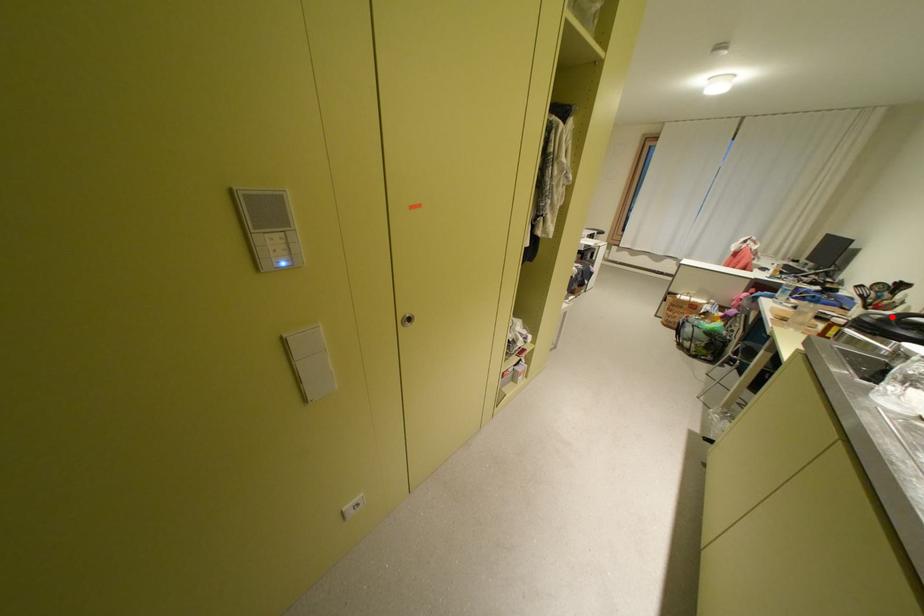
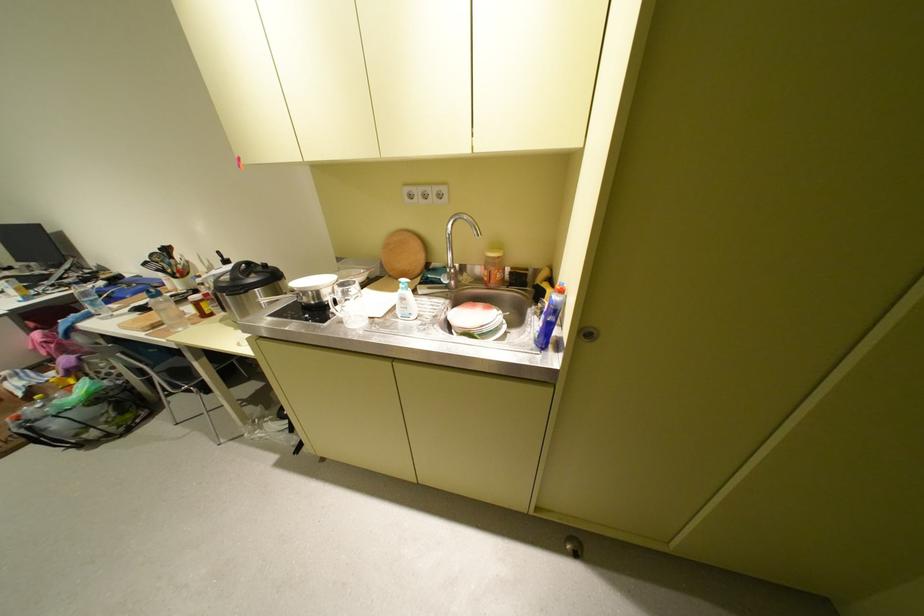
Where in the second image is the point corresponding to the highlighted location from the first image?

(237, 277)